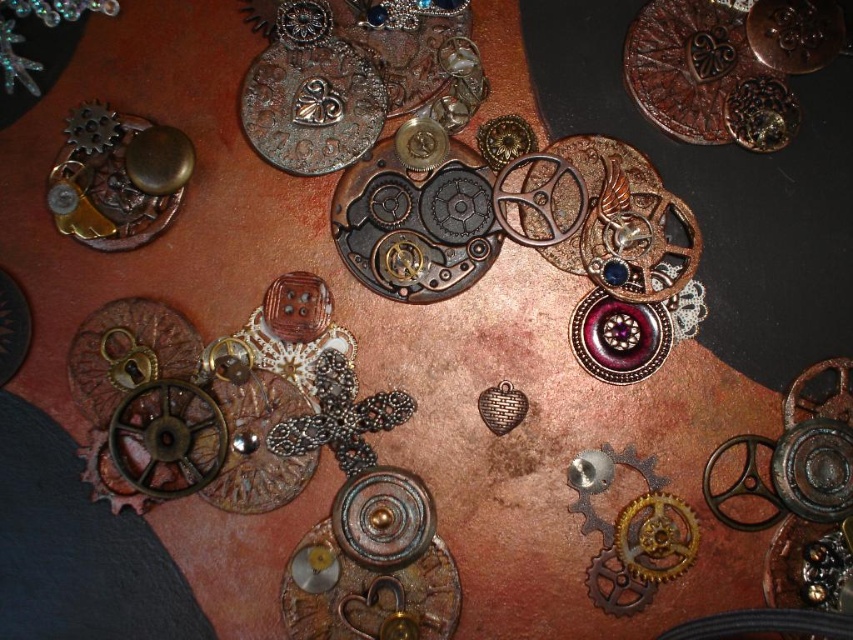
Question: Estimate the real-world distances between objects in this image. Which object is farther from the antique bronze heart at center?

Choices:
 (A) antique brass gear at center
 (B) copper textured gear at upper right

Answer: (B)

Question: Does antique brass gear at center have a smaller size compared to antique bronze heart at center?

Choices:
 (A) yes
 (B) no

Answer: (B)

Question: Is copper textured gear at upper right below matte gold gear at upper left?

Choices:
 (A) yes
 (B) no

Answer: (B)

Question: Does antique brass gear at center have a larger size compared to copper textured gear at upper right?

Choices:
 (A) no
 (B) yes

Answer: (A)

Question: Which point is farther from the camera taking this photo?

Choices:
 (A) (646, 588)
 (B) (460, 29)
 (C) (144, 179)
 (D) (756, 16)

Answer: (B)

Question: Which point is closer to the camera?

Choices:
 (A) antique bronze heart at center
 (B) copper textured gear at upper right

Answer: (B)